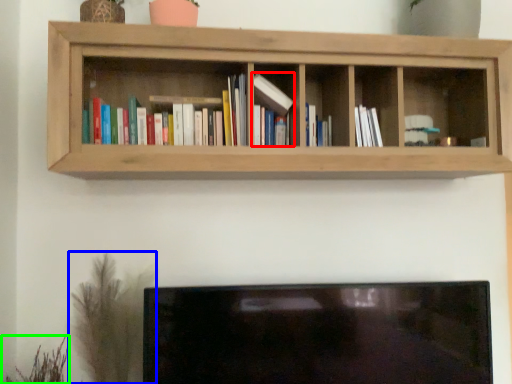
Question: Which object is the closest to the book (highlighted by a red box)? Choose among these: plant (highlighted by a blue box) or plant (highlighted by a green box).

Choices:
 (A) plant
 (B) plant

Answer: (A)